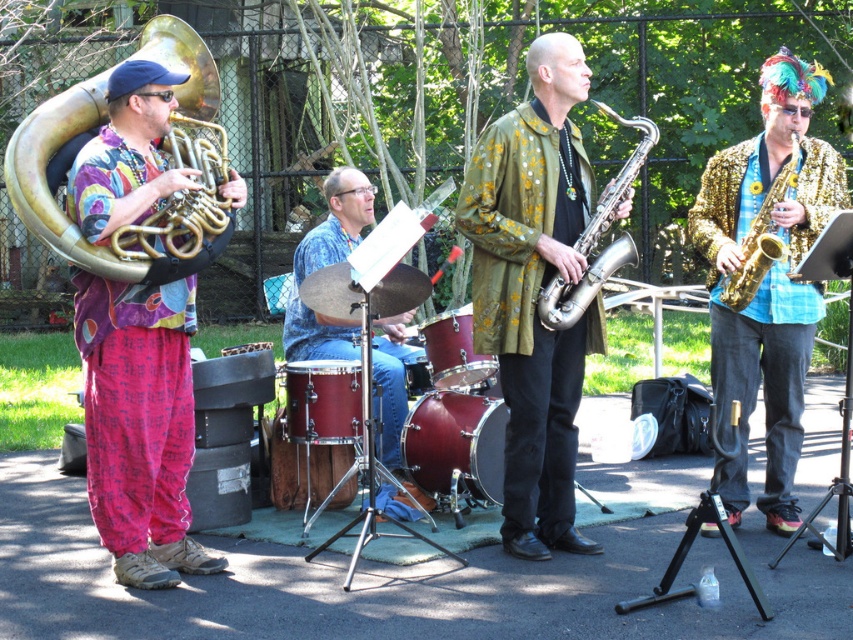
Who is positioned more to the left, shiny maroon drum at center or gold shiny saxophone at right?

Positioned to the left is shiny maroon drum at center.

Based on the photo, does shiny maroon drum at center have a larger size compared to gold shiny saxophone at right?

No, shiny maroon drum at center is not bigger than gold shiny saxophone at right.

Where is `shiny maroon drum at center`? shiny maroon drum at center is located at coordinates (456, 442).

You are a GUI agent. You are given a task and a screenshot of the screen. Output one action in this format:
    pyautogui.click(x=<x>, y=<y>)
    Task: Click on the shiny maroon drum at center
    The width and height of the screenshot is (853, 640).
    Given the screenshot: What is the action you would take?
    pyautogui.click(x=456, y=442)

Between point (86, 472) and point (434, 339), which one is positioned in front?

Positioned in front is point (86, 472).

Which is more to the right, brushed gold tuba at left or maroon drum at center?

Positioned to the right is maroon drum at center.

Where is `brushed gold tuba at left`? Image resolution: width=853 pixels, height=640 pixels. brushed gold tuba at left is located at coordinates (138, 424).

The width and height of the screenshot is (853, 640). Identify the location of brushed gold tuba at left. (138, 424).

Who is taller, shiny gold saxophone at center or gold sequined jacket at right?

Standing taller between the two is gold sequined jacket at right.

Which is more to the right, shiny gold saxophone at center or gold sequined jacket at right?

Positioned to the right is gold sequined jacket at right.

Which is in front, point (561, 188) or point (776, 332)?

Positioned in front is point (561, 188).

Identify the location of shiny gold saxophone at center. (534, 291).